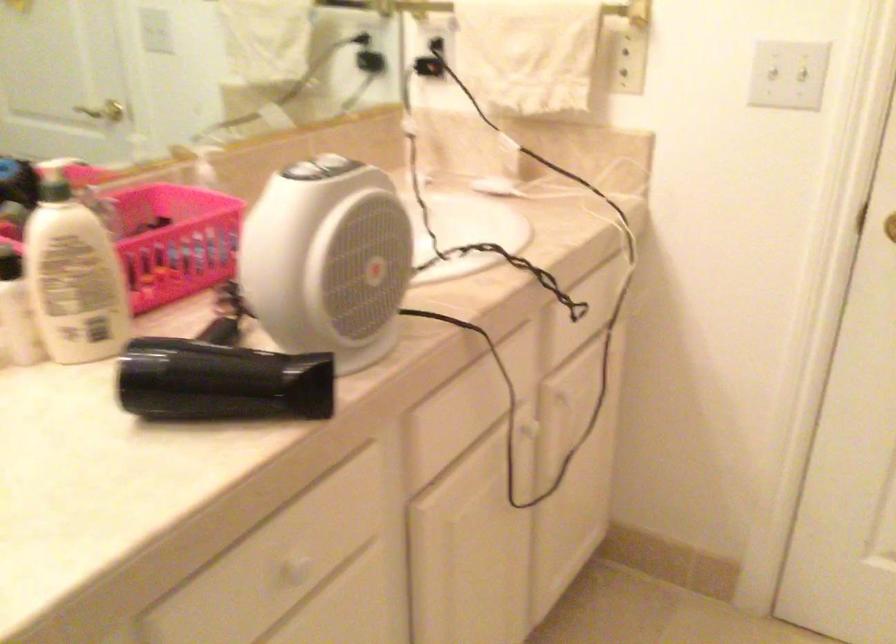
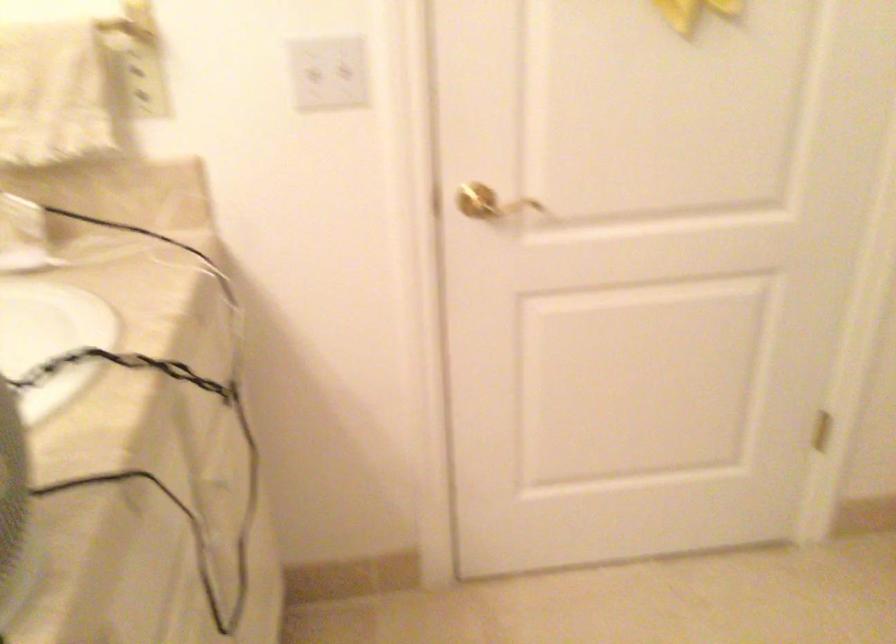
Question: The camera is either moving clockwise (left) or counter-clockwise (right) around the object. The first image is from the beginning of the video and the second image is from the end. Is the camera moving left or right when shooting the video?

Choices:
 (A) Left
 (B) Right

Answer: (A)